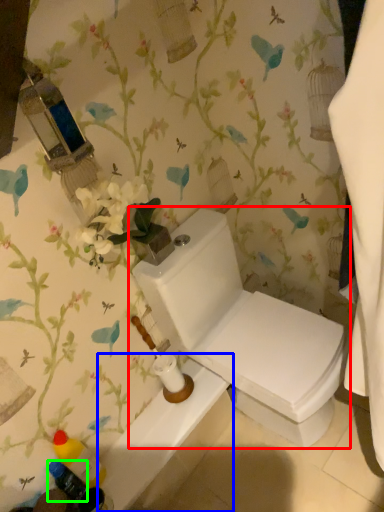
Question: Based on their relative distances, which object is farther from toilet (highlighted by a red box)? Choose from bath (highlighted by a blue box) and toiletry (highlighted by a green box).

Choices:
 (A) bath
 (B) toiletry

Answer: (B)